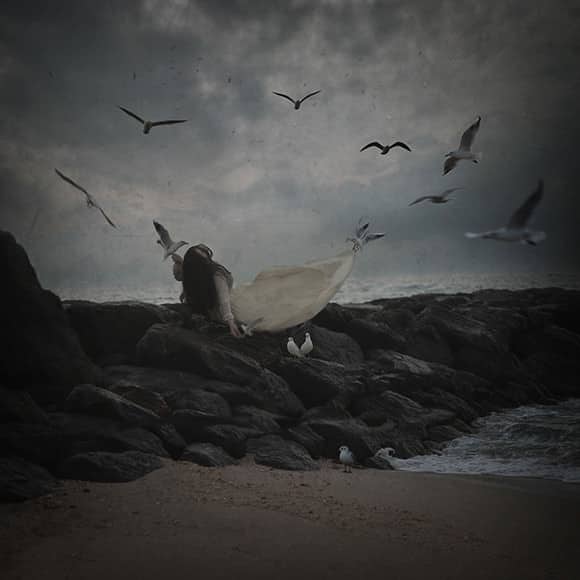
You are a GUI agent. You are given a task and a screenshot of the screen. Output one action in this format:
    pyautogui.click(x=<x>, y=<y>)
    Task: Click on the middle of the blanket
    The width and height of the screenshot is (580, 580).
    Given the screenshot: What is the action you would take?
    pyautogui.click(x=286, y=297)